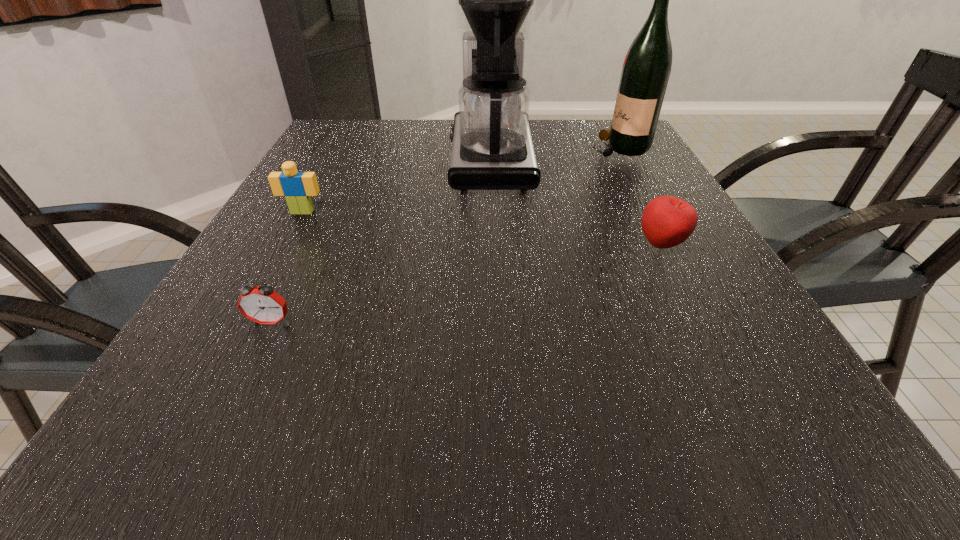
The width and height of the screenshot is (960, 540). I want to click on vacant space located on the face of the Lego, so click(x=265, y=279).

The image size is (960, 540). Identify the location of vacant space located on the front of the fourth farthest object. (759, 435).

Locate an element on the screen. vacant space located 0.070m on the clock face of the alarm clock is located at coordinates (251, 363).

This screenshot has height=540, width=960. Identify the location of wine bottle situated at the far edge. (646, 69).

Find the location of a particular element. This screenshot has width=960, height=540. coffee maker at the far edge is located at coordinates (492, 149).

This screenshot has height=540, width=960. I want to click on Lego that is at the left edge, so click(x=297, y=187).

The height and width of the screenshot is (540, 960). Identify the location of alarm clock that is at the left edge. (262, 305).

Where is `wine bottle that is at the right edge`? This screenshot has height=540, width=960. wine bottle that is at the right edge is located at coordinates (646, 69).

Where is `apple present at the right edge`? This screenshot has height=540, width=960. apple present at the right edge is located at coordinates (667, 221).

I want to click on object at the far right corner, so click(646, 69).